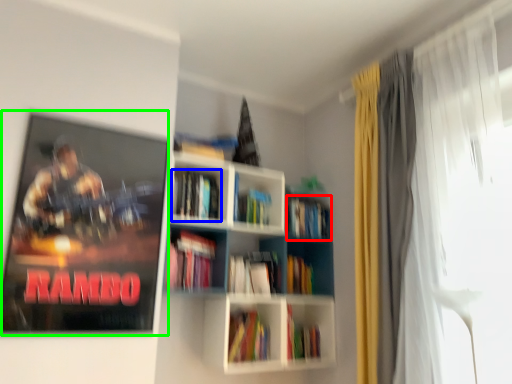
Question: Considering the real-world distances, which object is closest to book (highlighted by a red box)? book (highlighted by a blue box) or movie poster (highlighted by a green box).

Choices:
 (A) book
 (B) movie poster

Answer: (A)